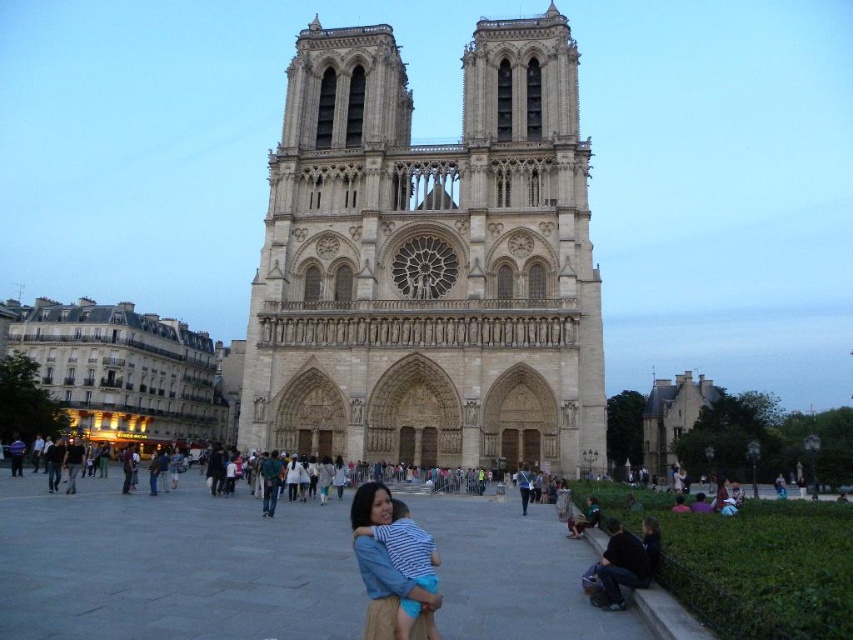
Between point (408, 595) and point (653, 452), which one is positioned in front?

Point (408, 595) is in front.

Which is behind, point (396, 577) or point (695, 410)?

The point (695, 410) is behind.

Between point (384, 509) and point (695, 392), which one is positioned behind?

Point (695, 392)

Image resolution: width=853 pixels, height=640 pixels. Find the location of `blue denim shirt at center`. blue denim shirt at center is located at coordinates (389, 593).

Does brown stone building at left have a greater width compared to blue denim shirt at center?

Correct, the width of brown stone building at left exceeds that of blue denim shirt at center.

Find the location of `brown stone building at left`. brown stone building at left is located at coordinates (125, 371).

Who is more distant from viewer, (219, 417) or (527, 500)?

The point (219, 417) is more distant.

The image size is (853, 640). What do you see at coordinates (125, 371) in the screenshot?
I see `brown stone building at left` at bounding box center [125, 371].

Who is more forward, (28,326) or (521,508)?

Point (521,508)

Locate an element on the screen. The image size is (853, 640). brown stone building at left is located at coordinates (125, 371).